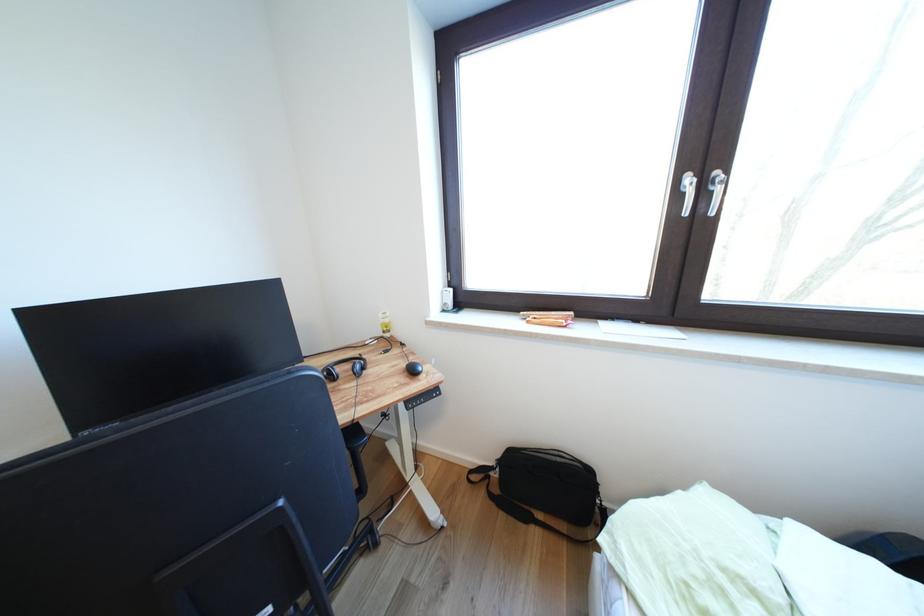
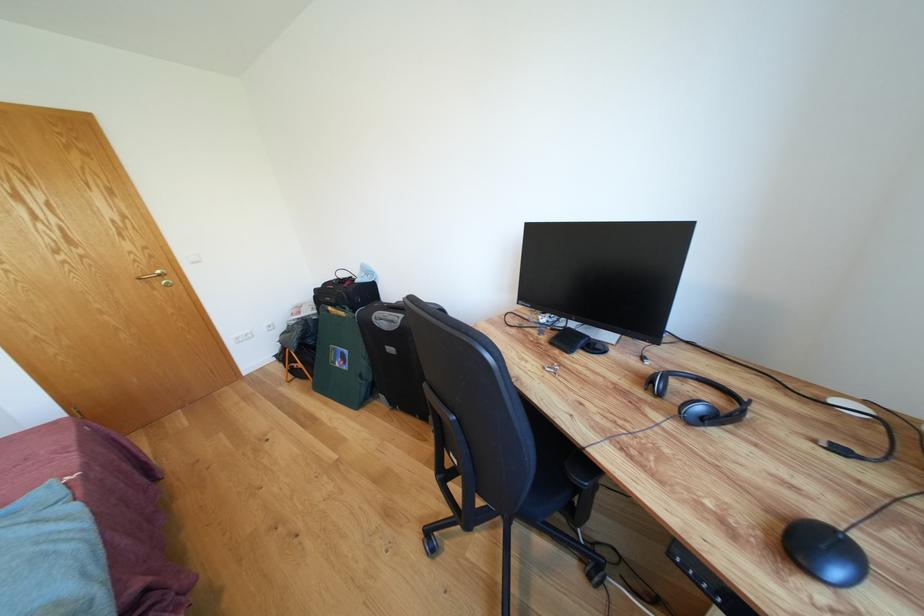
Locate, in the second image, the point that corresponds to the point at 371,373 in the first image.

(714, 424)